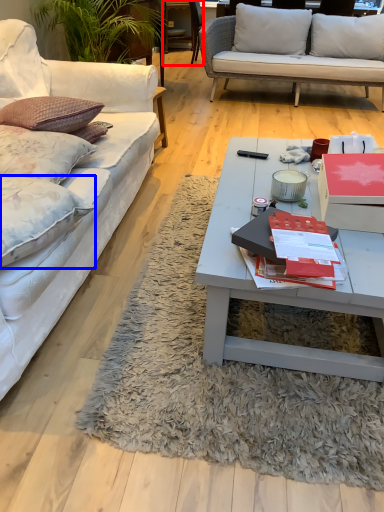
Question: Which object appears closest to the camera in this image, chair (highlighted by a red box) or pillow (highlighted by a blue box)?

Choices:
 (A) chair
 (B) pillow

Answer: (B)